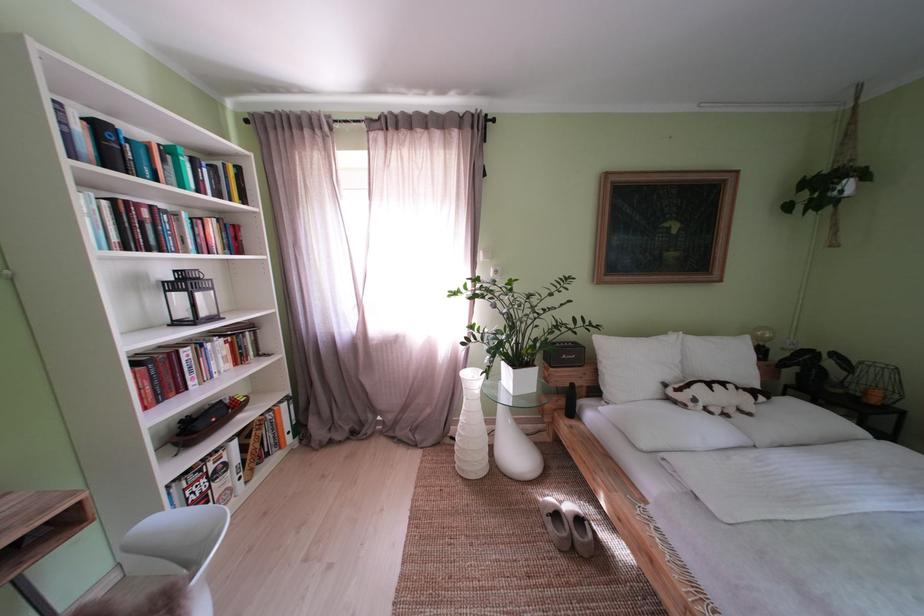
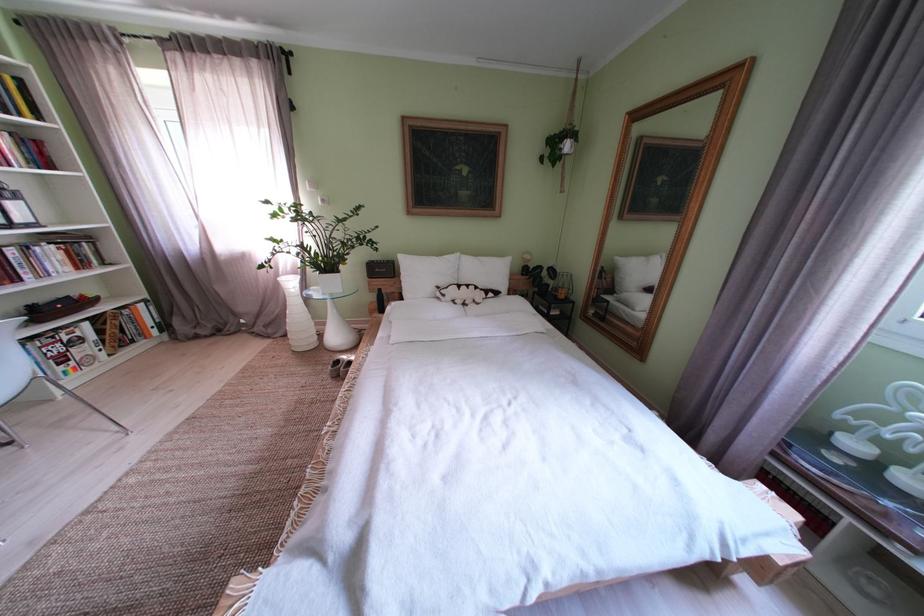
The point at (237,469) is marked in the first image. Where is the corresponding point in the second image?

(92, 344)